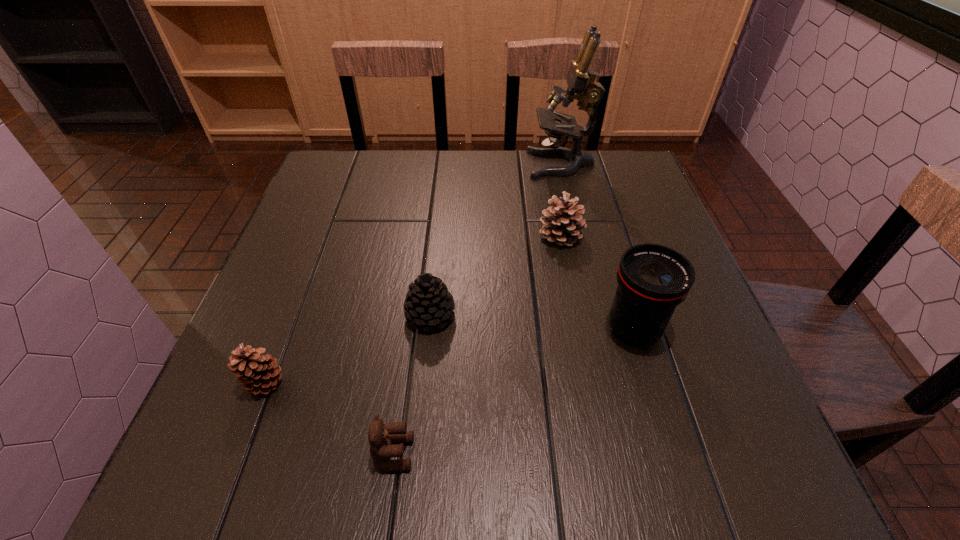
Where is `the tallest object`? Image resolution: width=960 pixels, height=540 pixels. the tallest object is located at coordinates (580, 79).

Where is `microscope`? Image resolution: width=960 pixels, height=540 pixels. microscope is located at coordinates (580, 79).

You are a GUI agent. You are given a task and a screenshot of the screen. Output one action in this format:
    pyautogui.click(x=<x>, y=<y>)
    Task: Click on the second tallest object
    
    Given the screenshot: What is the action you would take?
    pyautogui.click(x=653, y=279)

This screenshot has width=960, height=540. Identify the location of the fifth nearest object. (562, 222).

Locate an element on the screen. the rightmost pinecone is located at coordinates (562, 222).

Identify the location of the second nearest pinecone. pyautogui.click(x=428, y=303).

I want to click on the leftmost pinecone, so click(257, 373).

Where is `the leftmost object`? The height and width of the screenshot is (540, 960). the leftmost object is located at coordinates (257, 373).

Where is `teddy bear`? Image resolution: width=960 pixels, height=540 pixels. teddy bear is located at coordinates (380, 436).

This screenshot has width=960, height=540. In order to click on vacant space located 0.200m at the eyepieces of the farthest object in this screenshot , I will do `click(458, 164)`.